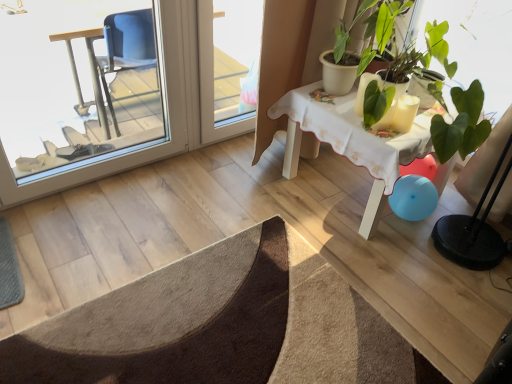
Identify the location of vacant area that lies between white wooden table at upper right and brown textured doormat at lower left. This screenshot has width=512, height=384. (292, 231).